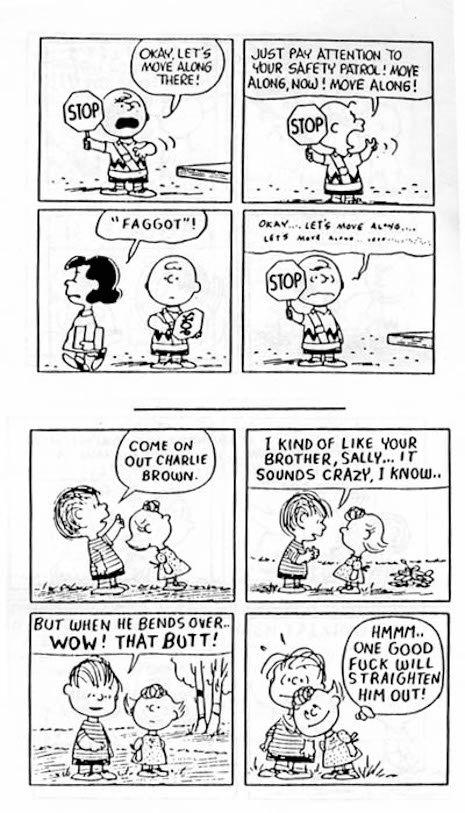
Locate an element on the screen. This screenshot has height=813, width=465. top right corner of panel is located at coordinates (232, 37), (430, 41), (231, 210), (433, 211), (235, 428), (447, 428), (232, 611), (448, 614).